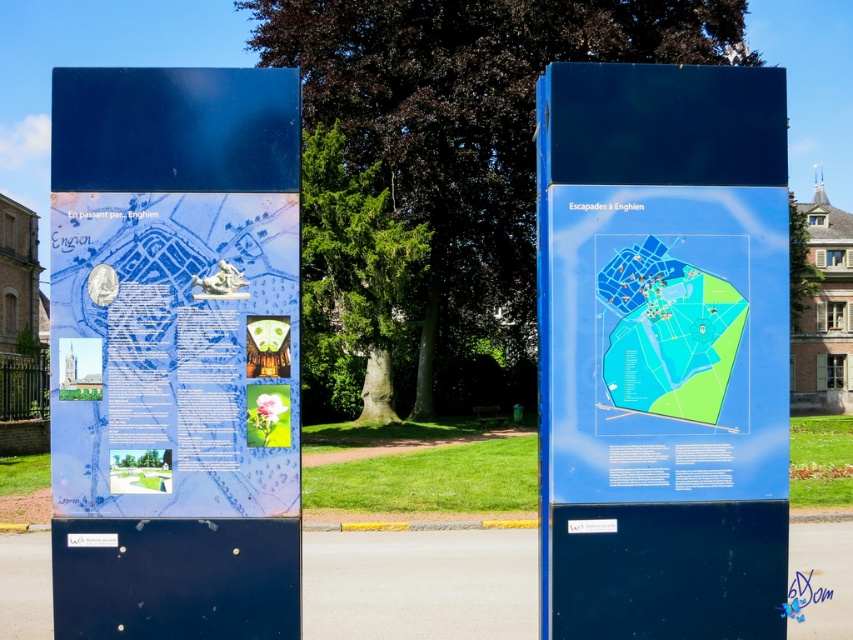
You are a tourist looking at the panels and want to read both the blue glossy poster at left and the transparent plastic map at center. Which one should you look at first if you want to start from the left side?

You should look at the blue glossy poster at left first because it is positioned to the left of the transparent plastic map at center.

What is the position of the blue glossy map at center on the left panel?

The blue glossy map at center is located at point (662, 349).

You are standing in front of the two panels in the park. You want to take a closer look at the blue glossy map at center on the left panel. Considering you can only move forward 3 meters, will you be able to reach it?

The blue glossy map at center is 5.00 meters away from the camera. Since you can only move forward 3 meters, you will not be able to reach it as the distance is greater than your movement capability.